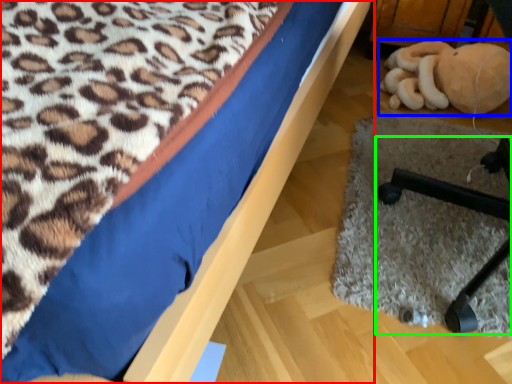
Question: Estimate the real-world distances between objects in this image. Which object is farther from bed (highlighted by a red box), toy (highlighted by a blue box) or furniture (highlighted by a green box)?

Choices:
 (A) toy
 (B) furniture

Answer: (A)